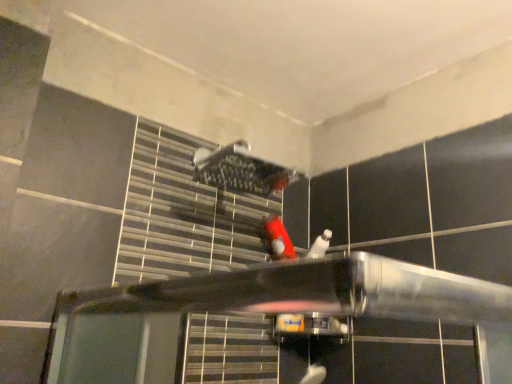
Find the location of `brushed metal shower at upper center`. brushed metal shower at upper center is located at coordinates (240, 171).

What do you see at coordinates (240, 171) in the screenshot? The image size is (512, 384). I see `brushed metal shower at upper center` at bounding box center [240, 171].

The height and width of the screenshot is (384, 512). What do you see at coordinates (277, 239) in the screenshot?
I see `red matte plush toy at center` at bounding box center [277, 239].

You are a GUI agent. You are given a task and a screenshot of the screen. Output one action in this format:
    pyautogui.click(x=<x>, y=<y>)
    Task: Click on the red matte plush toy at center
    Image resolution: width=512 pixels, height=384 pixels.
    Given the screenshot: What is the action you would take?
    pyautogui.click(x=277, y=239)

Where is `brushed metal shower at upper center`? Image resolution: width=512 pixels, height=384 pixels. brushed metal shower at upper center is located at coordinates (240, 171).

Visually, is brushed metal shower at upper center positioned to the left or to the right of red matte plush toy at center?

Based on their positions, brushed metal shower at upper center is located to the left of red matte plush toy at center.

Considering their positions, is brushed metal shower at upper center located in front of or behind red matte plush toy at center?

brushed metal shower at upper center is in front of red matte plush toy at center.

Is point (232, 164) positioned before point (288, 246)?

Yes, point (232, 164) is closer to viewer.

From the image's perspective, between brushed metal shower at upper center and red matte plush toy at center, who is located below?

From the image's view, red matte plush toy at center is below.

From a real-world perspective, is brushed metal shower at upper center physically above red matte plush toy at center?

Yes, from a real-world perspective, brushed metal shower at upper center is above red matte plush toy at center.

Is brushed metal shower at upper center thinner than red matte plush toy at center?

Indeed, brushed metal shower at upper center has a lesser width compared to red matte plush toy at center.

Can you confirm if brushed metal shower at upper center is taller than red matte plush toy at center?

Yes, brushed metal shower at upper center is taller than red matte plush toy at center.

Looking at the image, does brushed metal shower at upper center seem bigger or smaller compared to red matte plush toy at center?

Clearly, brushed metal shower at upper center is larger in size than red matte plush toy at center.

Does brushed metal shower at upper center contain red matte plush toy at center?

No, red matte plush toy at center is not a part of brushed metal shower at upper center.

Looking at this image, can you see brushed metal shower at upper center touching red matte plush toy at center?

No, brushed metal shower at upper center is not in contact with red matte plush toy at center.

Is brushed metal shower at upper center positioned with its back to red matte plush toy at center?

No, brushed metal shower at upper center is not facing the opposite direction of red matte plush toy at center.

This screenshot has width=512, height=384. In order to click on shower above the red matte plush toy at center (from a real-world perspective) in this screenshot , I will do `click(240, 171)`.

Between red matte plush toy at center and brushed metal shower at upper center, which one appears on the left side from the viewer's perspective?

Positioned to the left is brushed metal shower at upper center.

Is red matte plush toy at center positioned in front of brushed metal shower at upper center?

That is False.

Between point (277, 217) and point (261, 181), which one is positioned behind?

The point (277, 217) is more distant.

From the image's perspective, is red matte plush toy at center located beneath brushed metal shower at upper center?

Yes.

From a real-world perspective, is red matte plush toy at center physically located above or below brushed metal shower at upper center?

red matte plush toy at center is situated lower than brushed metal shower at upper center in the real world.

Is red matte plush toy at center wider or thinner than brushed metal shower at upper center?

Clearly, red matte plush toy at center has more width compared to brushed metal shower at upper center.

Is red matte plush toy at center shorter than brushed metal shower at upper center?

Indeed, red matte plush toy at center has a lesser height compared to brushed metal shower at upper center.

Does red matte plush toy at center have a smaller size compared to brushed metal shower at upper center?

Indeed, red matte plush toy at center has a smaller size compared to brushed metal shower at upper center.

Is red matte plush toy at center surrounding brushed metal shower at upper center?

Definitely not — brushed metal shower at upper center is not inside red matte plush toy at center.

Is there a large distance between red matte plush toy at center and brushed metal shower at upper center?

That's not correct — red matte plush toy at center is a little close to brushed metal shower at upper center.

Is red matte plush toy at center positioned with its back to brushed metal shower at upper center?

No, brushed metal shower at upper center is not at the back of red matte plush toy at center.

Measure the distance from red matte plush toy at center to brushed metal shower at upper center.

red matte plush toy at center and brushed metal shower at upper center are 10.00 inches apart from each other.

Find the location of a particular element. The width and height of the screenshot is (512, 384). person below the brushed metal shower at upper center (from a real-world perspective) is located at coordinates (277, 239).

Where is `shower to the left of red matte plush toy at center`? This screenshot has height=384, width=512. shower to the left of red matte plush toy at center is located at coordinates (240, 171).

At what (x,y) coordinates should I click in order to perform the action: click on person on the right of brushed metal shower at upper center. Please return your answer as a coordinate pair (x, y). This screenshot has width=512, height=384. Looking at the image, I should click on (277, 239).